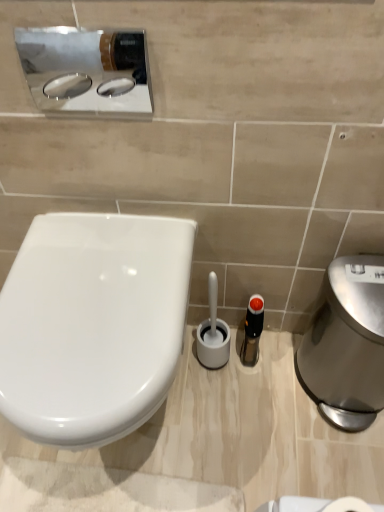
Question: From the image's perspective, is polished chrome sink at upper left positioned above or below white glossy toilet at left?

Choices:
 (A) above
 (B) below

Answer: (A)

Question: In terms of height, does polished chrome sink at upper left look taller or shorter compared to white glossy toilet at left?

Choices:
 (A) short
 (B) tall

Answer: (A)

Question: Estimate the real-world distances between objects in this image. Which object is closer to the white glossy toilet at left?

Choices:
 (A) polished chrome sink at upper left
 (B) polished stainless steel hand dryer at right
 (C) translucent plastic bottle at center

Answer: (A)

Question: Which of these objects is positioned farthest from the white glossy toilet at left?

Choices:
 (A) translucent plastic bottle at center
 (B) polished stainless steel hand dryer at right
 (C) polished chrome sink at upper left

Answer: (B)